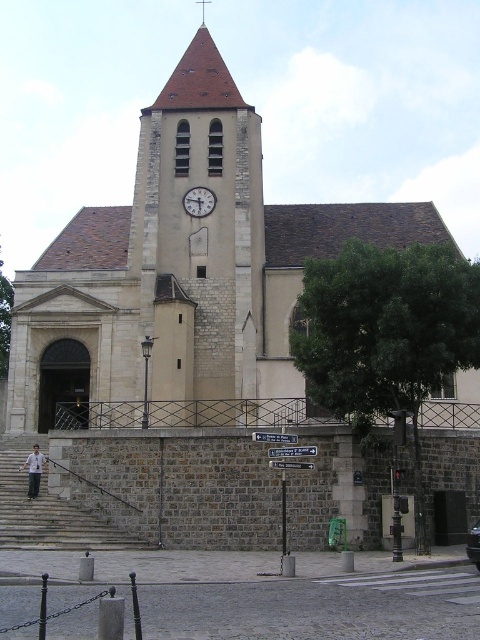
Question: Which point appears farthest from the camera in this image?

Choices:
 (A) (129, 538)
 (B) (197, 1)

Answer: (B)

Question: Can you confirm if white glossy clock at center is positioned to the left of smooth gold spire at upper center?

Choices:
 (A) yes
 (B) no

Answer: (B)

Question: Which of the following is the farthest from the observer?

Choices:
 (A) gray stone stairs at lower left
 (B) white glossy clock at center

Answer: (B)

Question: Which object is closer to the camera taking this photo?

Choices:
 (A) gray stone stairs at lower left
 (B) white glossy clock at center
 (C) metallic silver car at center

Answer: (C)

Question: Does gray stone stairs at lower left appear over smooth gold spire at upper center?

Choices:
 (A) no
 (B) yes

Answer: (A)

Question: Does beige stone clock tower at center appear on the left side of white glossy clock at center?

Choices:
 (A) no
 (B) yes

Answer: (A)